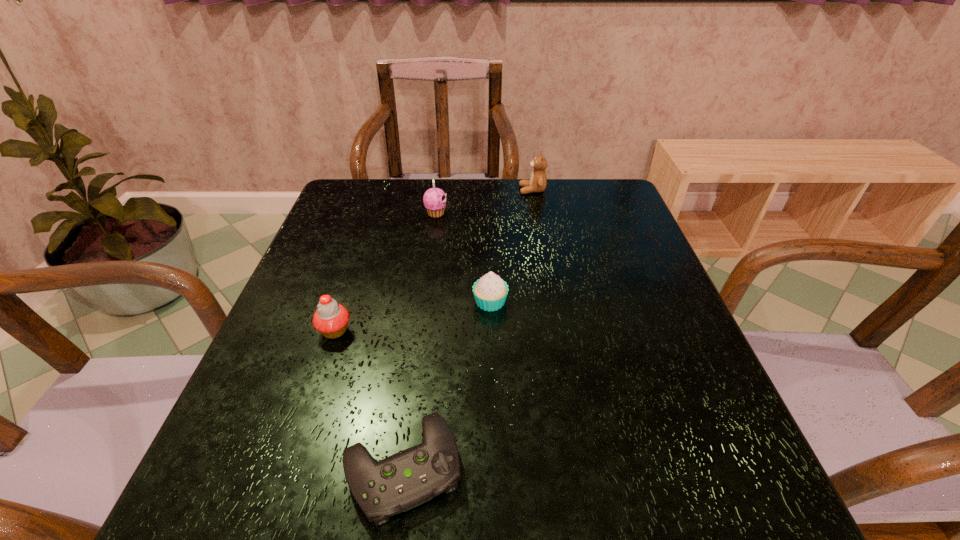
Where is `free point located on the front-facing side of the rightmost object`? free point located on the front-facing side of the rightmost object is located at coordinates (430, 190).

Image resolution: width=960 pixels, height=540 pixels. What are the coordinates of `free region located 0.050m on the front-facing side of the rightmost object` in the screenshot? It's located at (502, 190).

Locate an element on the screen. free point located on the front-facing side of the rightmost object is located at coordinates (454, 190).

Where is `vacant space located 0.330m on the face of the second farthest object`? This screenshot has width=960, height=540. vacant space located 0.330m on the face of the second farthest object is located at coordinates (570, 213).

Identify the location of vacant space located 0.070m on the left of the nearest cupcake. The width and height of the screenshot is (960, 540). (282, 330).

The width and height of the screenshot is (960, 540). In order to click on free location located 0.300m on the left of the second nearest cupcake in this screenshot , I will do `click(330, 302)`.

Find the location of `vacant space located 0.180m on the back of the nearest object`. vacant space located 0.180m on the back of the nearest object is located at coordinates (420, 335).

The height and width of the screenshot is (540, 960). In order to click on teddy bear present at the far edge in this screenshot , I will do `click(537, 183)`.

What are the coordinates of `cupcake located at the far edge` in the screenshot? It's located at (434, 199).

Image resolution: width=960 pixels, height=540 pixels. Find the location of `object at the near edge`. object at the near edge is located at coordinates (409, 478).